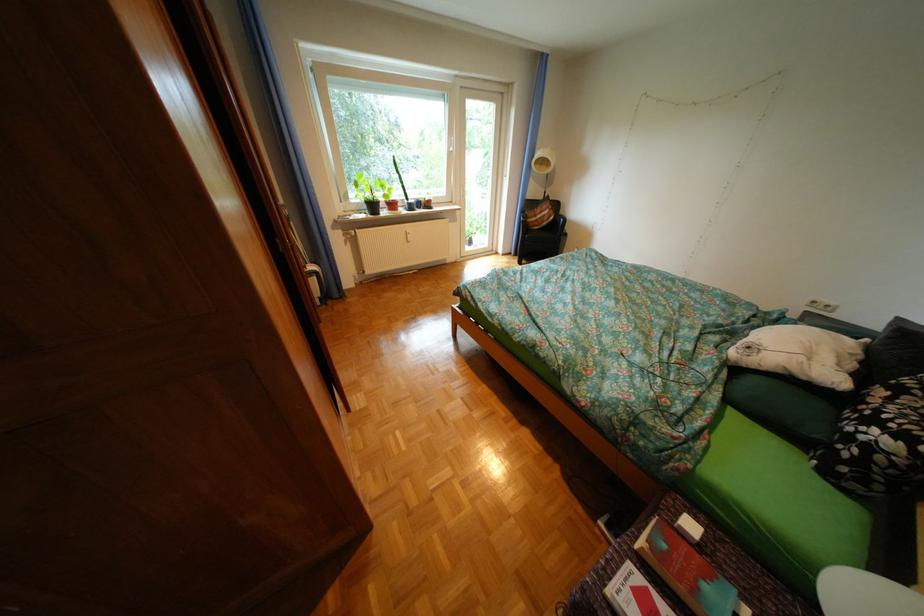
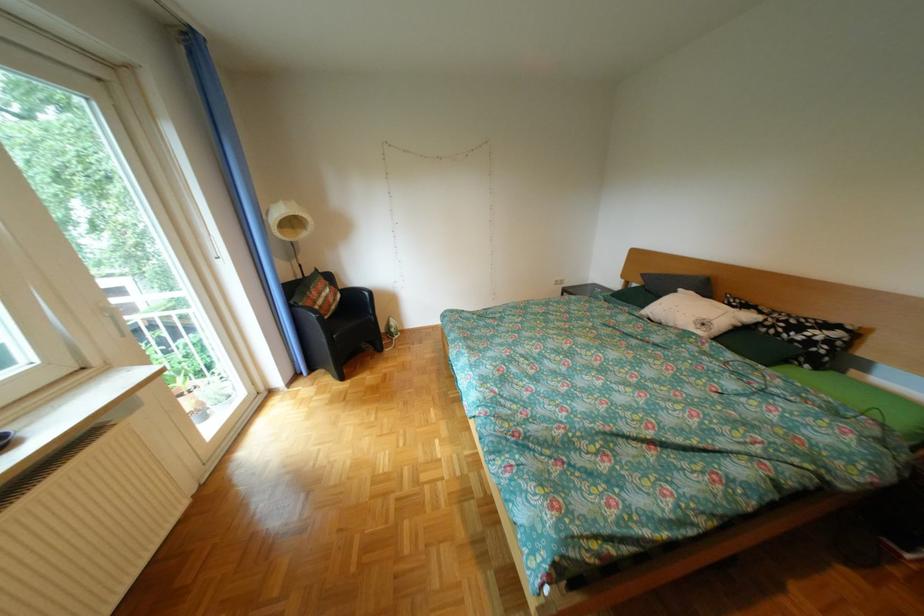
The point at [763,349] is marked in the first image. Where is the corresponding point in the second image?

(718, 325)